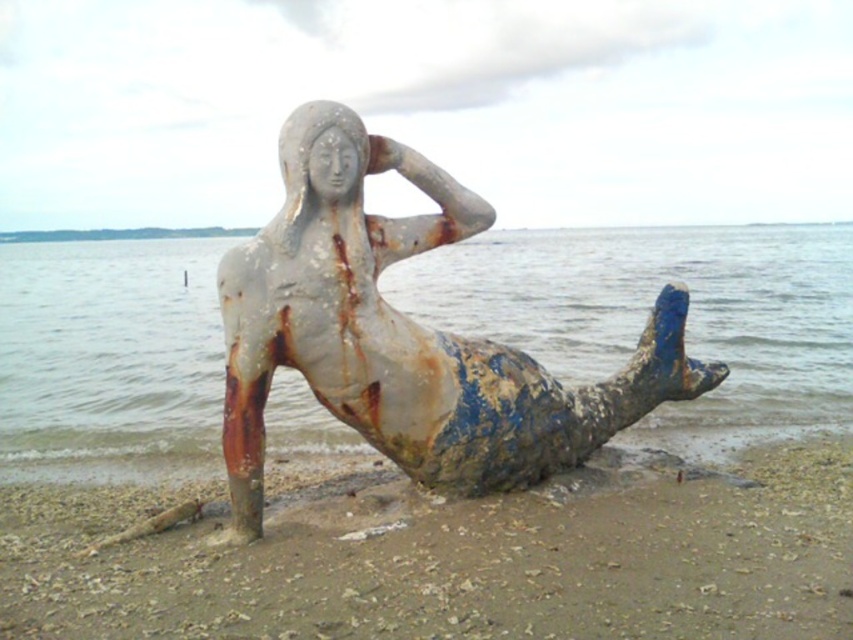
You are standing on the beach looking at the mermaid statue. You see rusty metallic sand at lower center and rusty metallic water at center. Which object is positioned to the right of the other?

The rusty metallic sand at lower center is to the right of the rusty metallic water at center.

Based on the photo, you are standing on the beach looking at the mermaid statue. There is a rusty metallic sand at lower center marked by point (450, 557). If you want to place a small flag exactly at that point, which direction should you walk from the statue to reach it?

The rusty metallic sand at lower center is located at point (450, 557). Since it is at lower center, you should walk towards the lower center direction from the statue to place the flag there.

You are a beachcomber searching for hidden treasures on the beach. You notice rusty metallic sand at lower center and rusty metallic water at center. Which object is located below the other?

The rusty metallic sand at lower center is positioned under rusty metallic water at center, so the sand is below the water.